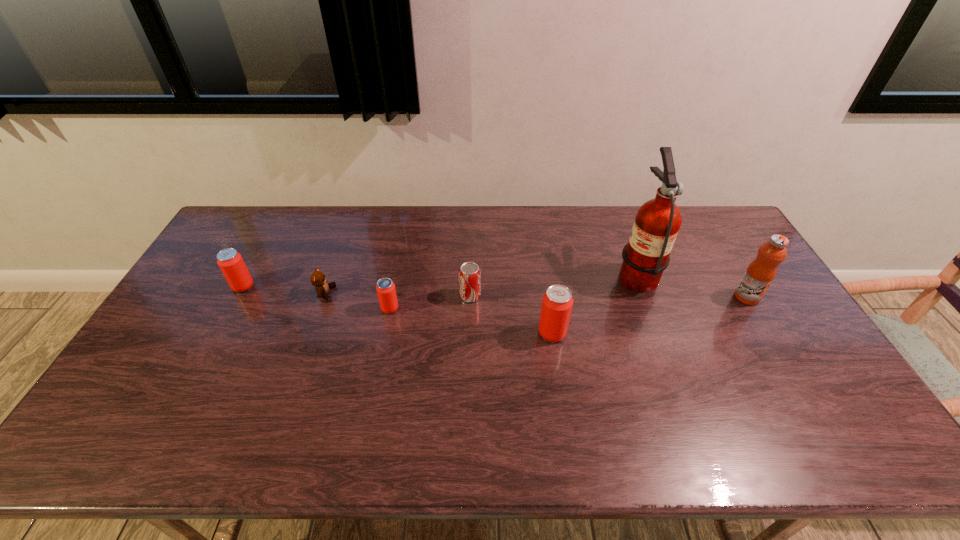
Given the evenly spaced beer cans in the image, where should an extra beer can be added on the right to preserve the spacing? Please point to a vacant space. Please provide its 2D coordinates. Your answer should be formatted as a tuple, i.e. [(x, y)], where the tuple contains the x and y coordinates of a point satisfying the conditions above.

[(732, 360)]